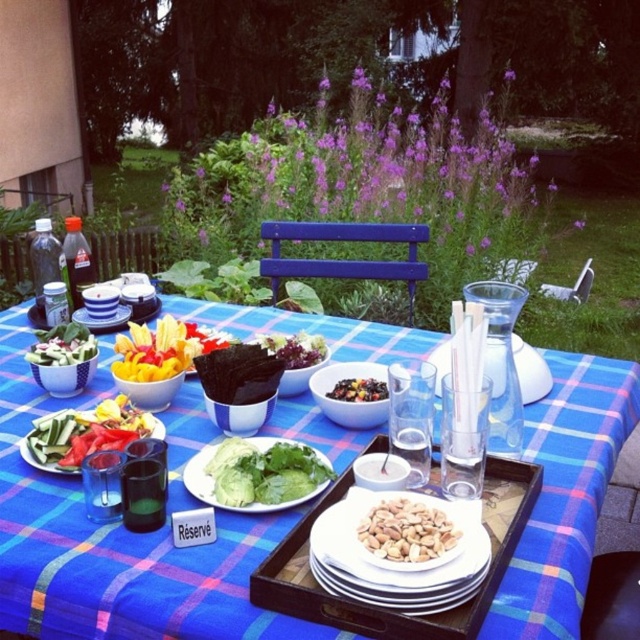
Question: Is smooth beige peanuts at center bigger than green leafy salad at center?

Choices:
 (A) yes
 (B) no

Answer: (B)

Question: Which point is farther from the camera taking this photo?

Choices:
 (A) (460, 513)
 (B) (348, 387)

Answer: (B)

Question: Estimate the real-world distances between objects in this image. Which object is closer to the shiny dark chocolate at center?

Choices:
 (A) white matte plate at center
 (B) green leafy salad at center
 (C) white ceramic bowl at center

Answer: (B)

Question: Does white ceramic bowl at center have a smaller size compared to shiny dark chocolate at center?

Choices:
 (A) no
 (B) yes

Answer: (A)

Question: Based on their relative distances, which object is nearer to the wooden tray at center?

Choices:
 (A) bright red pepper at center
 (B) shiny dark chocolate at center

Answer: (B)

Question: Is white matte plate at center further to camera compared to bright red pepper at center?

Choices:
 (A) no
 (B) yes

Answer: (A)